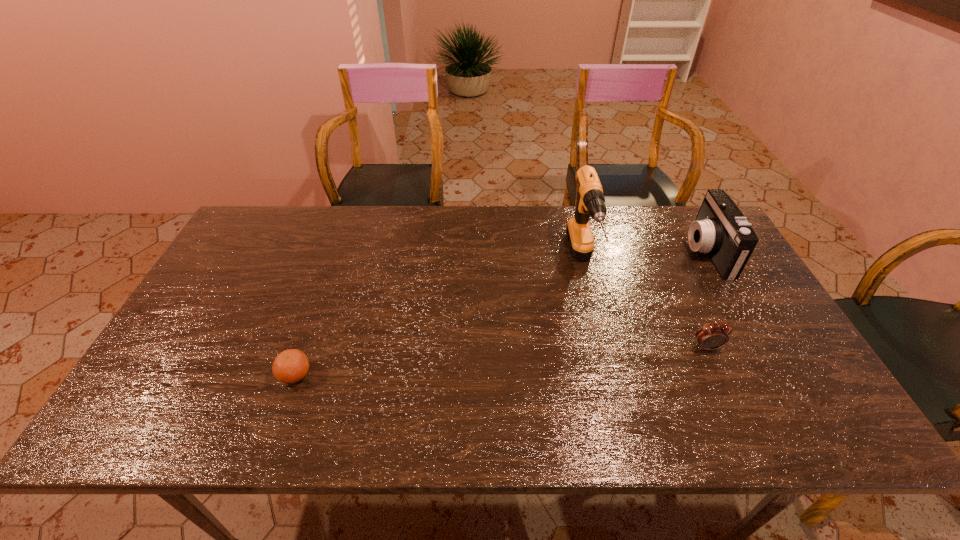
This screenshot has height=540, width=960. Find the location of `the tallest object`. the tallest object is located at coordinates (591, 202).

Locate an element on the screen. The image size is (960, 540). drill is located at coordinates (591, 202).

Find the location of a particular element. This screenshot has width=960, height=540. the second tallest object is located at coordinates (720, 229).

At what (x,y) coordinates should I click in order to perform the action: click on camcorder. Please return your answer as a coordinate pair (x, y). The image size is (960, 540). Looking at the image, I should click on (720, 229).

Find the location of `the second nearest object`. the second nearest object is located at coordinates (711, 336).

Locate an element on the screen. the second object from right to left is located at coordinates (711, 336).

This screenshot has height=540, width=960. I want to click on the nearest object, so click(x=290, y=366).

Where is `the shortest object`? the shortest object is located at coordinates (290, 366).

Image resolution: width=960 pixels, height=540 pixels. Identify the location of free space located at the tip of the drill. (611, 376).

The height and width of the screenshot is (540, 960). Identify the location of vacant space located 0.080m on the lens of the camcorder. (662, 252).